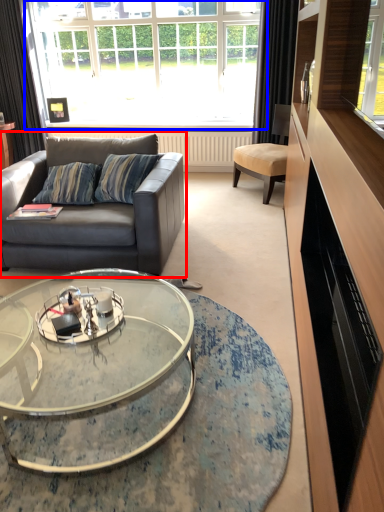
Question: Which object appears farthest to the camera in this image, studio couch (highlighted by a red box) or window (highlighted by a blue box)?

Choices:
 (A) studio couch
 (B) window

Answer: (B)